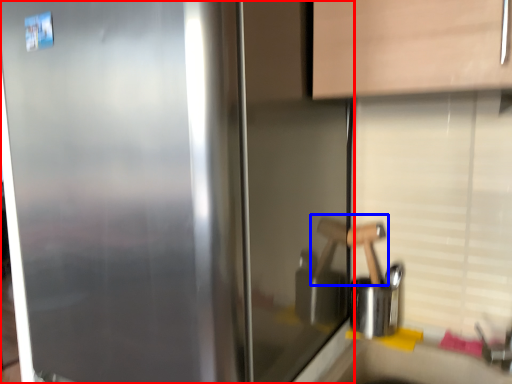
Question: Which of the following is the closest to the observer, refrigerator (highlighted by a red box) or door handle (highlighted by a blue box)?

Choices:
 (A) refrigerator
 (B) door handle

Answer: (A)